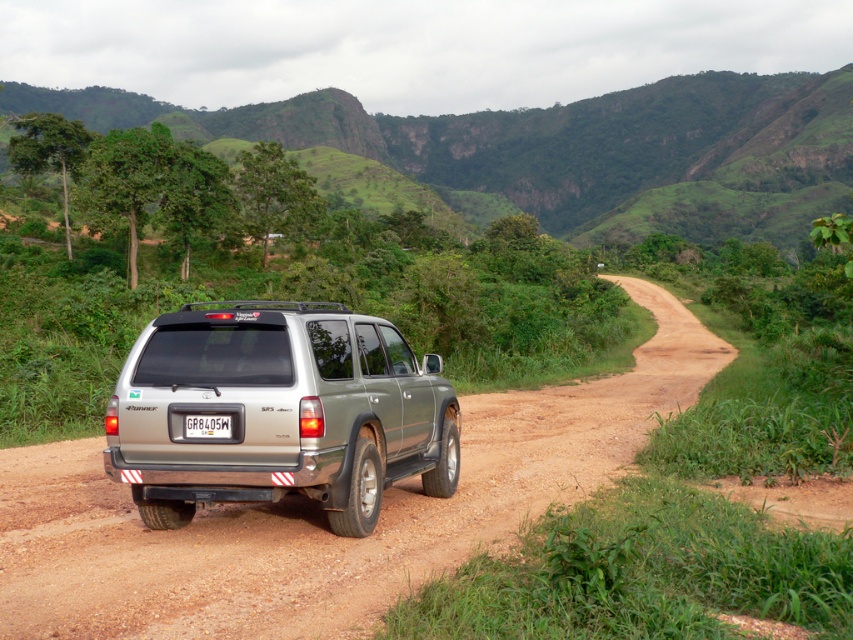
Question: Does satin silver suv at center have a smaller size compared to white plastic license plate at rear?

Choices:
 (A) no
 (B) yes

Answer: (A)

Question: Which point appears closest to the camera in this image?

Choices:
 (A) (202, 436)
 (B) (430, 164)
 (C) (288, 404)

Answer: (C)

Question: Among these points, which one is farthest from the camera?

Choices:
 (A) (221, 429)
 (B) (238, 109)

Answer: (B)

Question: Is green grassy hillside at upper center closer to the viewer compared to white plastic license plate at rear?

Choices:
 (A) no
 (B) yes

Answer: (A)

Question: Is green grassy hillside at upper center positioned behind white plastic license plate at rear?

Choices:
 (A) yes
 (B) no

Answer: (A)

Question: Which of the following is the farthest from the observer?

Choices:
 (A) (190, 433)
 (B) (498, 179)
 (C) (140, 509)

Answer: (B)